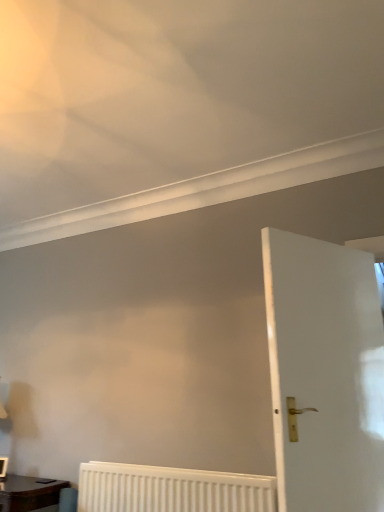
Question: Can you confirm if white textured radiator at lower center is smaller than white glossy door at right?

Choices:
 (A) no
 (B) yes

Answer: (B)

Question: Does white textured radiator at lower center appear on the right side of white glossy door at right?

Choices:
 (A) no
 (B) yes

Answer: (A)

Question: From a real-world perspective, is white textured radiator at lower center positioned over white glossy door at right based on gravity?

Choices:
 (A) no
 (B) yes

Answer: (A)

Question: From the image's perspective, is white textured radiator at lower center below white glossy door at right?

Choices:
 (A) yes
 (B) no

Answer: (A)

Question: Is white textured radiator at lower center far from white glossy door at right?

Choices:
 (A) yes
 (B) no

Answer: (B)

Question: Considering the positions of white textured radiator at lower center and white glossy door at right in the image, is white textured radiator at lower center taller or shorter than white glossy door at right?

Choices:
 (A) tall
 (B) short

Answer: (B)

Question: Is white textured radiator at lower center spatially inside white glossy door at right, or outside of it?

Choices:
 (A) inside
 (B) outside

Answer: (B)

Question: Looking at their shapes, would you say white textured radiator at lower center is wider or thinner than white glossy door at right?

Choices:
 (A) wide
 (B) thin

Answer: (B)

Question: From a real-world perspective, relative to white glossy door at right, is white textured radiator at lower center vertically above or below?

Choices:
 (A) below
 (B) above

Answer: (A)

Question: Is matte brown wooden table at lower left spatially inside white glossy door at right, or outside of it?

Choices:
 (A) outside
 (B) inside

Answer: (A)

Question: Would you say matte brown wooden table at lower left is to the left or to the right of white glossy door at right in the picture?

Choices:
 (A) right
 (B) left

Answer: (B)

Question: Is point (3, 488) positioned closer to the camera than point (349, 350)?

Choices:
 (A) closer
 (B) farther

Answer: (B)

Question: Is matte brown wooden table at lower left in front of or behind white glossy door at right in the image?

Choices:
 (A) behind
 (B) front

Answer: (A)

Question: Is white glossy door at right spatially inside matte brown wooden table at lower left, or outside of it?

Choices:
 (A) outside
 (B) inside

Answer: (A)

Question: Is point (311, 320) positioned closer to the camera than point (56, 492)?

Choices:
 (A) farther
 (B) closer

Answer: (B)